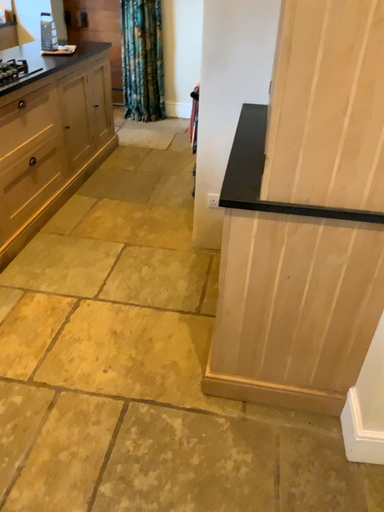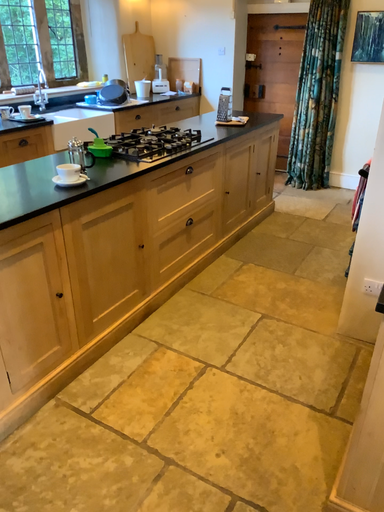
Question: How did the camera likely rotate when shooting the video?

Choices:
 (A) rotated downward
 (B) rotated upward

Answer: (B)